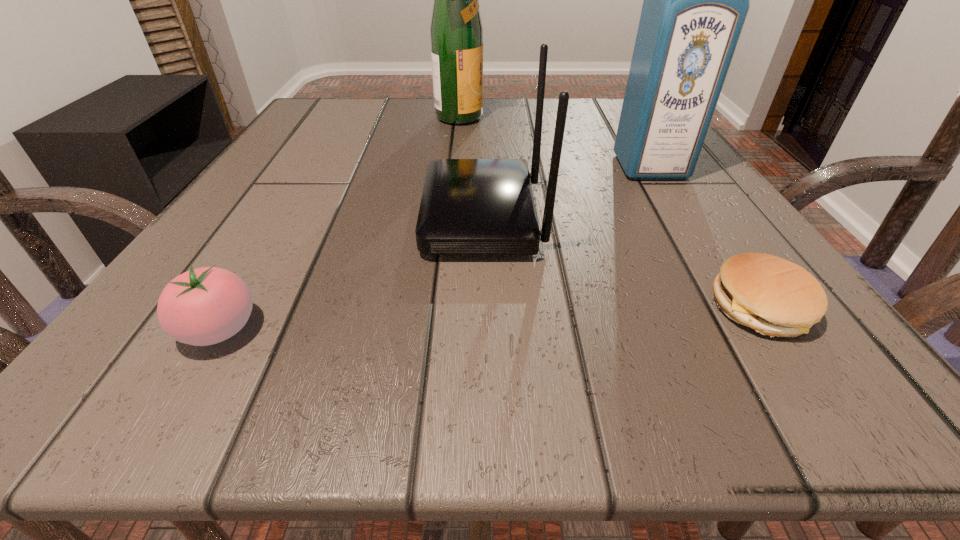
I want to click on free space located 0.280m on the front-facing side of the router, so click(237, 217).

At what (x,y) coordinates should I click in order to perform the action: click on vacant area located 0.220m on the front-facing side of the router. Please return your answer as a coordinate pair (x, y). The height and width of the screenshot is (540, 960). Looking at the image, I should click on (276, 217).

At what (x,y) coordinates should I click in order to perform the action: click on blank space located on the right of the leftmost object. Please return your answer as a coordinate pair (x, y). The width and height of the screenshot is (960, 540). Looking at the image, I should click on (539, 329).

The image size is (960, 540). Find the location of `vacant space located 0.070m on the left of the patty`. vacant space located 0.070m on the left of the patty is located at coordinates (652, 308).

This screenshot has height=540, width=960. What are the coordinates of `object positioned at the far edge` in the screenshot? It's located at (456, 31).

The image size is (960, 540). I want to click on tomato located in the near edge section of the desktop, so click(204, 306).

Where is `patty that is at the near edge`? patty that is at the near edge is located at coordinates (776, 297).

I want to click on object that is at the left edge, so click(204, 306).

Where is `liquor that is at the right edge`? The width and height of the screenshot is (960, 540). liquor that is at the right edge is located at coordinates (696, 0).

You are a GUI agent. You are given a task and a screenshot of the screen. Output one action in this format:
    pyautogui.click(x=<x>, y=<y>)
    Task: Click on the patty that is at the right edge
    This screenshot has width=960, height=540.
    Given the screenshot: What is the action you would take?
    pyautogui.click(x=776, y=297)